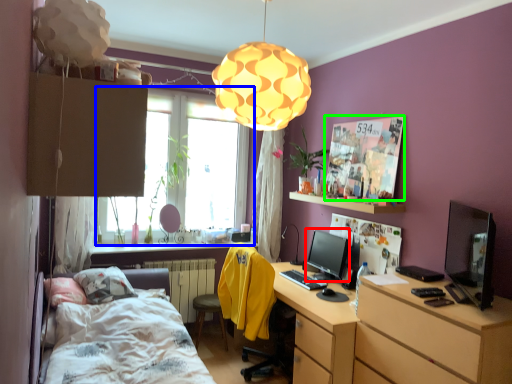
Question: Which is farther away from computer monitor (highlighted by a red box)? window (highlighted by a blue box) or poster page (highlighted by a green box)?

Choices:
 (A) window
 (B) poster page

Answer: (A)